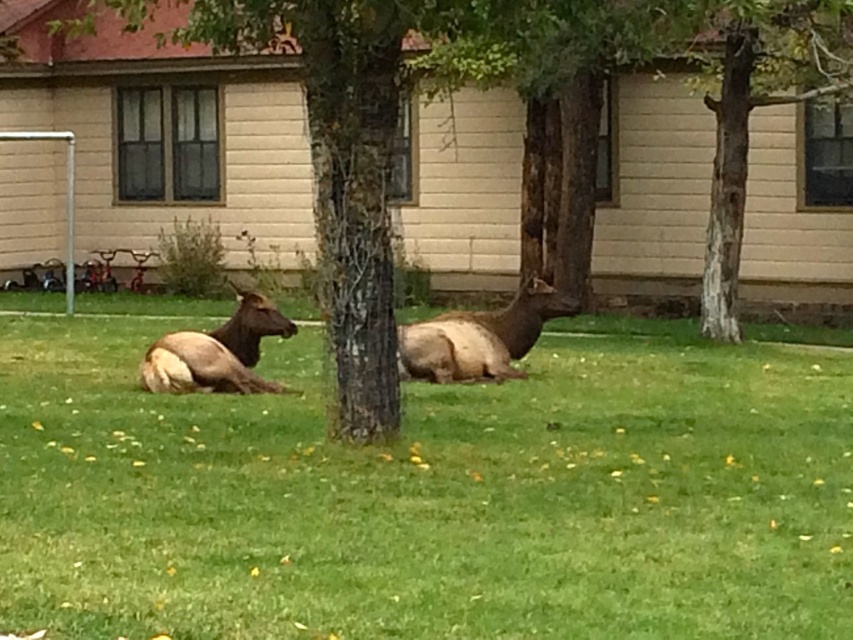
Question: Which point appears closest to the camera in this image?

Choices:
 (A) (721, 96)
 (B) (234, 314)

Answer: (B)

Question: Can you confirm if green grass at center is smaller than brown furry deer at left?

Choices:
 (A) no
 (B) yes

Answer: (A)

Question: Based on their relative distances, which object is nearer to the white textured bark at center?

Choices:
 (A) green grass at center
 (B) brown furry deer at left
 (C) brown matte/deer at center

Answer: (C)

Question: Is green grass at center bigger than brown furry deer at left?

Choices:
 (A) yes
 (B) no

Answer: (A)

Question: Observing the image, what is the correct spatial positioning of green bark tree at center in reference to brown matte/deer at center?

Choices:
 (A) above
 (B) below

Answer: (A)

Question: Which point appears farthest from the camera in this image?

Choices:
 (A) (593, 161)
 (B) (509, 310)
 (C) (802, 22)
 (D) (744, 515)

Answer: (A)